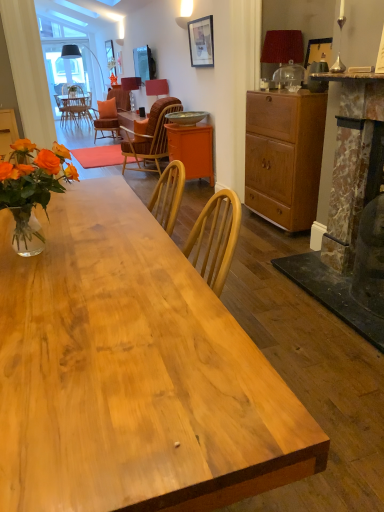
Question: From a real-world perspective, is matte orange lampshade at upper center, the 2th lamp positioned from the left, physically below matte orange lampshade at center, the 3th lamp from the bottom?

Choices:
 (A) no
 (B) yes

Answer: (A)

Question: From a real-world perspective, does matte orange lampshade at upper center, which is the 2th lamp in front-to-back order, stand above matte orange lampshade at center, the 3th lamp from the bottom?

Choices:
 (A) yes
 (B) no

Answer: (A)

Question: Can you confirm if matte orange lampshade at upper center, arranged as the 2th lamp when viewed from the right, is shorter than matte orange lampshade at center, positioned as the 3th lamp in right-to-left order?

Choices:
 (A) yes
 (B) no

Answer: (A)

Question: Is the position of matte orange lampshade at upper center, the 2th lamp positioned from the left, more distant than that of matte orange lampshade at center, which is the 3th lamp in front-to-back order?

Choices:
 (A) yes
 (B) no

Answer: (B)

Question: Can matte orange lampshade at center, which is the 3th lamp in front-to-back order, be found inside matte orange lampshade at upper center, which is the 2th lamp in front-to-back order?

Choices:
 (A) yes
 (B) no

Answer: (B)

Question: Is matte orange lampshade at upper center, which is the 2th lamp in front-to-back order, facing away from matte orange lampshade at center, positioned as the 3th lamp in right-to-left order?

Choices:
 (A) yes
 (B) no

Answer: (B)

Question: Is red fabric lampshade at upper right, arranged as the 3th lamp when viewed from the left, further to camera compared to matte black picture frame at upper center?

Choices:
 (A) no
 (B) yes

Answer: (A)

Question: Does red fabric lampshade at upper right, which is counted as the 1th lamp, starting from the bottom, lie in front of matte black picture frame at upper center?

Choices:
 (A) no
 (B) yes

Answer: (B)

Question: From a real-world perspective, is red fabric lampshade at upper right, which is counted as the 1th lamp, starting from the bottom, over matte black picture frame at upper center?

Choices:
 (A) yes
 (B) no

Answer: (B)

Question: Is red fabric lampshade at upper right, the first lamp in the front-to-back sequence, thinner than matte black picture frame at upper center?

Choices:
 (A) yes
 (B) no

Answer: (B)

Question: Is red fabric lampshade at upper right, arranged as the 3th lamp when viewed from the left, positioned with its back to matte black picture frame at upper center?

Choices:
 (A) yes
 (B) no

Answer: (B)

Question: Is red fabric lampshade at upper right, which appears as the 3th lamp when viewed from the back, not close to matte black picture frame at upper center?

Choices:
 (A) yes
 (B) no

Answer: (A)

Question: Is natural wood desk at center next to orange matte cabinet at center, arranged as the second cabinetry when viewed from the right, and touching it?

Choices:
 (A) yes
 (B) no

Answer: (B)